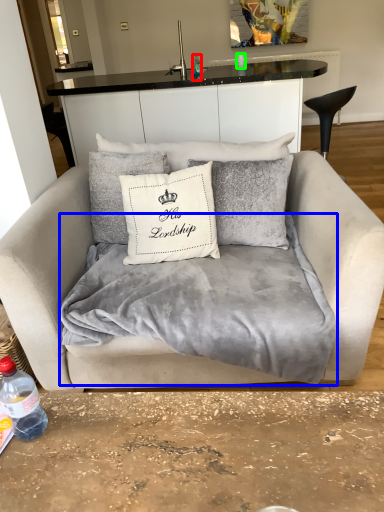
Question: Which object is positioned closest to bottle (highlighted by a red box)? Select from blanket (highlighted by a blue box) and coffee cup (highlighted by a green box).

Choices:
 (A) blanket
 (B) coffee cup

Answer: (B)